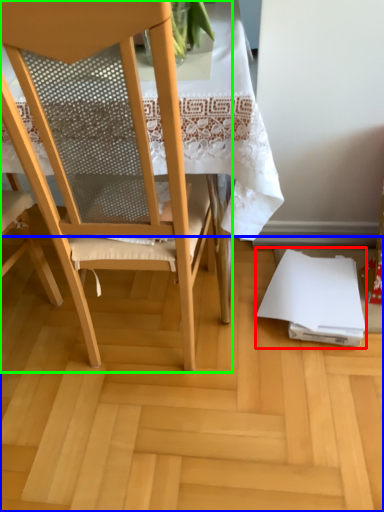
Question: Based on their relative distances, which object is farther from notebook (highlighted by a red box)? Choose from plywood (highlighted by a blue box) and chair (highlighted by a green box).

Choices:
 (A) plywood
 (B) chair

Answer: (B)